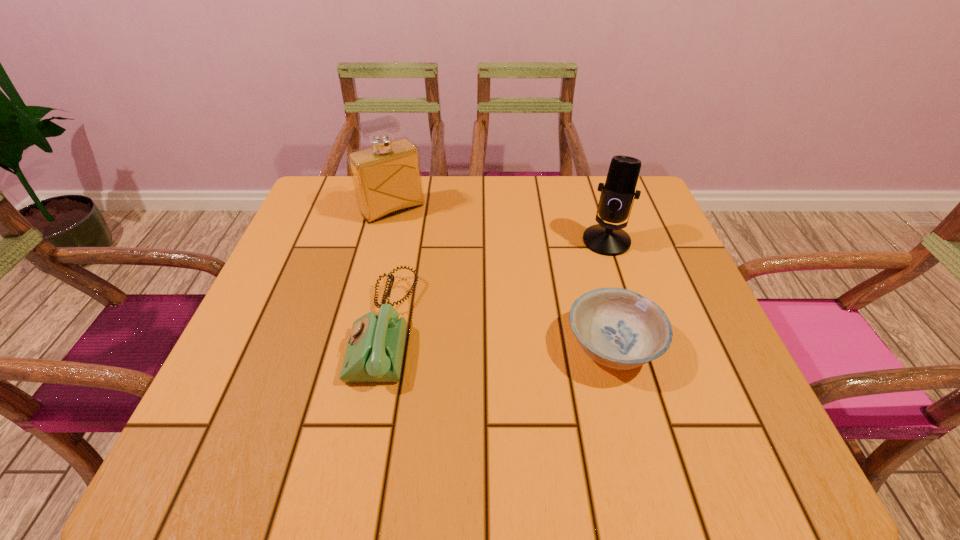
The height and width of the screenshot is (540, 960). Find the location of `object present at the far right corner`. object present at the far right corner is located at coordinates (616, 198).

You are a GUI agent. You are given a task and a screenshot of the screen. Output one action in this format:
    pyautogui.click(x=<x>, y=<y>)
    Task: Click on the object at the near right corner
    
    Given the screenshot: What is the action you would take?
    pyautogui.click(x=618, y=328)

Locate an element on the screen. vacant space at the far edge of the desktop is located at coordinates (474, 197).

Where is `vacant region at the near edge of the desktop`? This screenshot has width=960, height=540. vacant region at the near edge of the desktop is located at coordinates (420, 387).

The height and width of the screenshot is (540, 960). In the image, there is a desktop. What are the coordinates of `vacant space at the left edge` in the screenshot? It's located at (303, 304).

The image size is (960, 540). Find the location of `vacant space at the right edge of the desktop`. vacant space at the right edge of the desktop is located at coordinates (702, 347).

The height and width of the screenshot is (540, 960). I want to click on unoccupied area between the farthest object and the telephone, so click(389, 268).

Locate an element on the screen. The width and height of the screenshot is (960, 540). vacant area that lies between the farthest object and the bowl is located at coordinates (502, 278).

At what (x,y) coordinates should I click in order to perform the action: click on free space between the microphone and the telephone. Please return your answer as a coordinate pair (x, y). This screenshot has width=960, height=540. Looking at the image, I should click on (495, 284).

Find the location of a particular element. This screenshot has width=960, height=540. free space between the telephone and the farthest object is located at coordinates (389, 268).